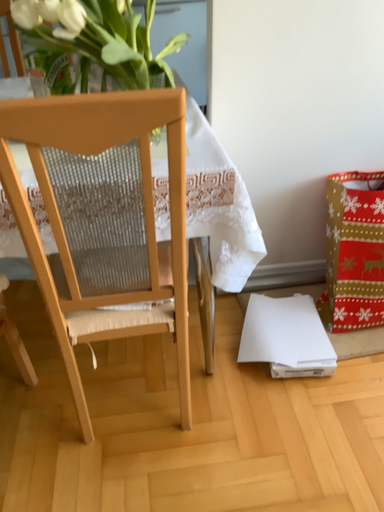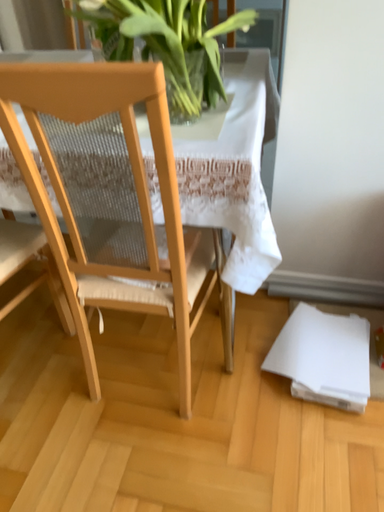
Question: Which way did the camera rotate in the video?

Choices:
 (A) rotated left
 (B) rotated right

Answer: (A)